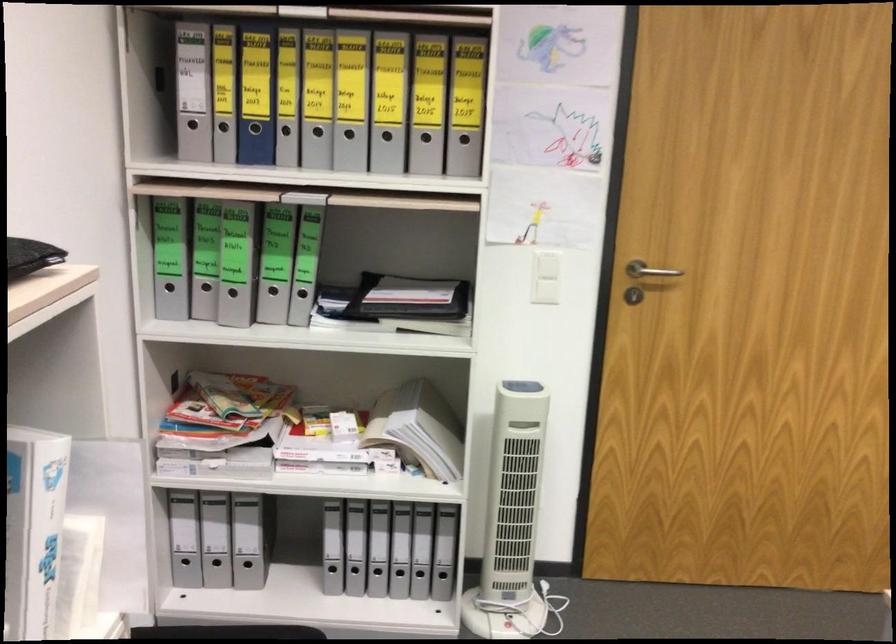
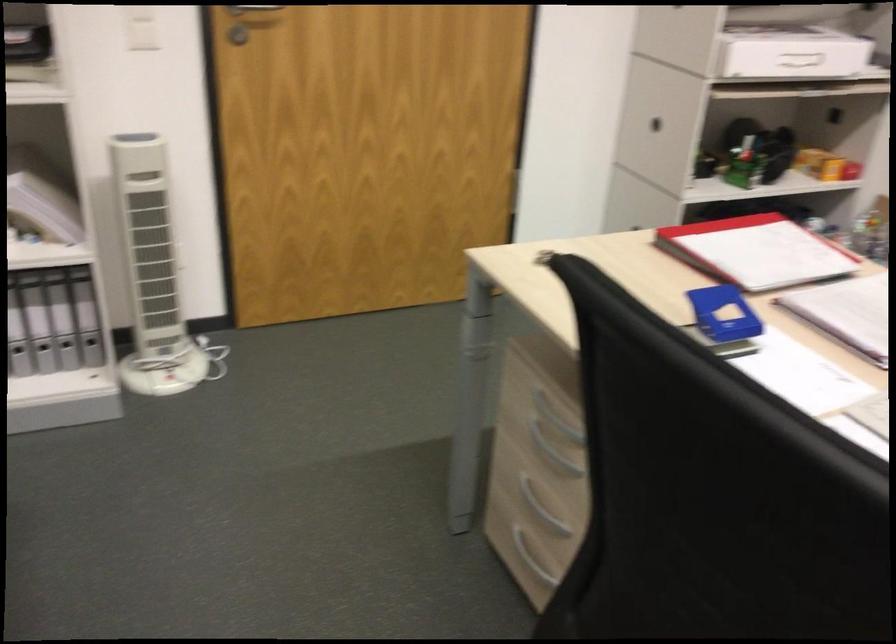
The point at (418,574) is marked in the first image. Where is the corresponding point in the second image?

(65, 344)